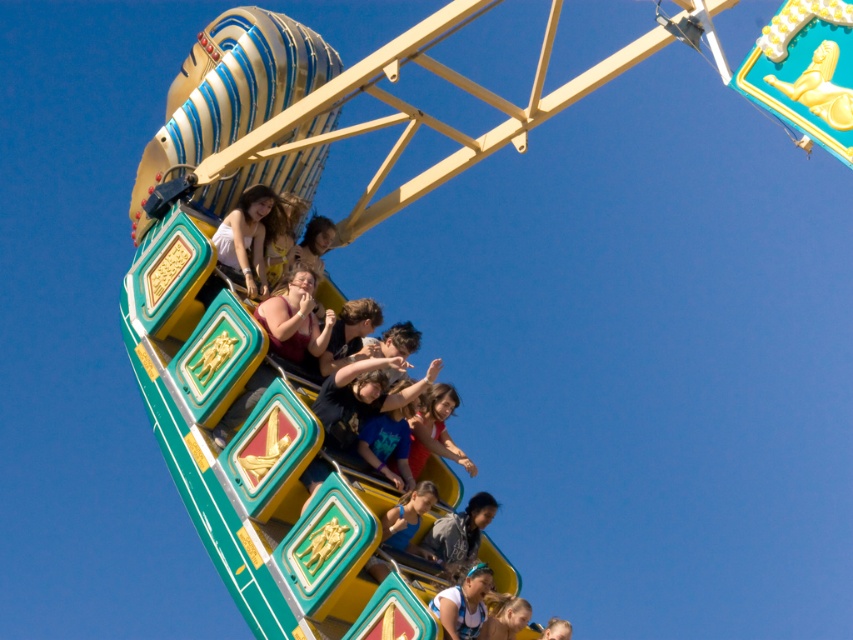
Between matte black shirt at center and blue denim shirt at lower center, which one appears on the right side from the viewer's perspective?

blue denim shirt at lower center is more to the right.

You are a GUI agent. You are given a task and a screenshot of the screen. Output one action in this format:
    pyautogui.click(x=<x>, y=<y>)
    Task: Click on the matte black shirt at center
    The image size is (853, 640).
    Given the screenshot: What is the action you would take?
    pyautogui.click(x=302, y=451)

Does point (338, 300) lie in front of point (467, 636)?

That is False.

Identify the location of matte black shirt at center. (302, 451).

Can you confirm if matte blue hair at lower center is shorter than light brown hair at lower center?

Yes.

Does matte blue hair at lower center have a lesser width compared to light brown hair at lower center?

Yes, matte blue hair at lower center is thinner than light brown hair at lower center.

Does point (496, 609) lie in front of point (566, 621)?

Yes, point (496, 609) is closer to viewer.

I want to click on matte blue hair at lower center, so click(503, 616).

Which is below, matte maroon shirt at center or gray fabric shirt at center?

Positioned lower is gray fabric shirt at center.

Is point (286, 305) positioned behind point (469, 561)?

Yes, it is behind point (469, 561).

Which is behind, point (293, 324) or point (460, 515)?

The point (460, 515) is behind.

At what (x,y) coordinates should I click in order to perform the action: click on matte maroon shirt at center. Please return your answer as a coordinate pair (x, y). Image resolution: width=853 pixels, height=640 pixels. Looking at the image, I should click on (294, 317).